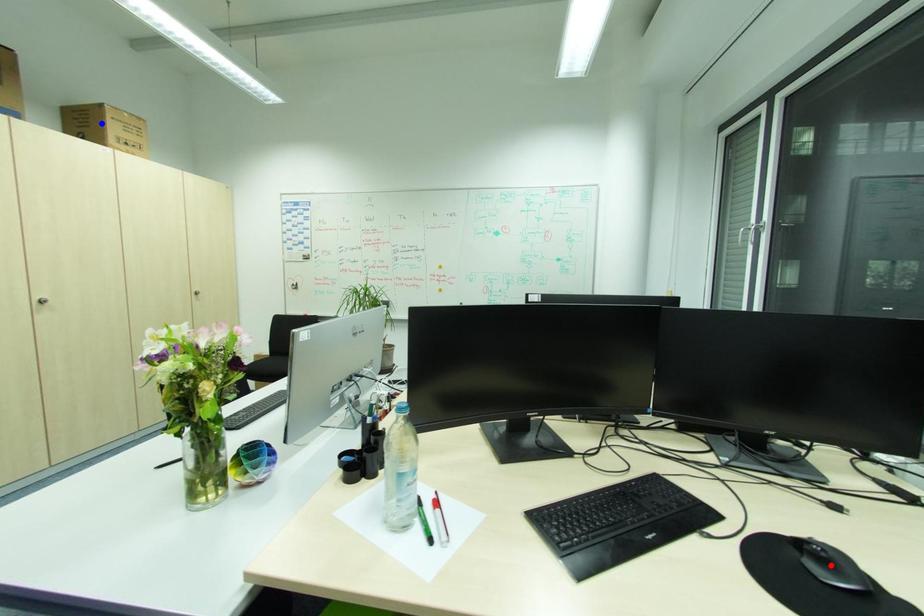
Question: Which of the two points in the image is closer to the camera?

Choices:
 (A) Blue point is closer.
 (B) Red point is closer.

Answer: (B)